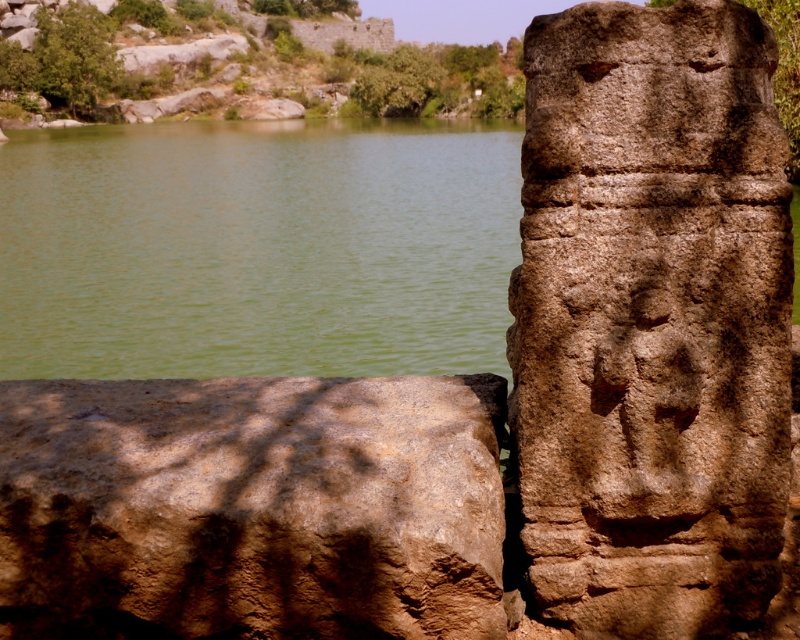
Question: Which point appears farthest from the camera in this image?

Choices:
 (A) (624, 182)
 (B) (44, 467)

Answer: (B)

Question: Is brown rough stone carving at right positioned in front of green water at center?

Choices:
 (A) no
 (B) yes

Answer: (B)

Question: Which point appears closest to the camera in this image?

Choices:
 (A) (290, 326)
 (B) (545, 388)
 (C) (252, 484)

Answer: (C)

Question: Is brown rough stone at lower left closer to camera compared to green water at center?

Choices:
 (A) yes
 (B) no

Answer: (A)

Question: Is brown rough stone carving at right below brown rough stone at lower left?

Choices:
 (A) no
 (B) yes

Answer: (A)

Question: Which is nearer to the green water at center?

Choices:
 (A) brown rough stone at lower left
 (B) brown rough stone carving at right

Answer: (A)